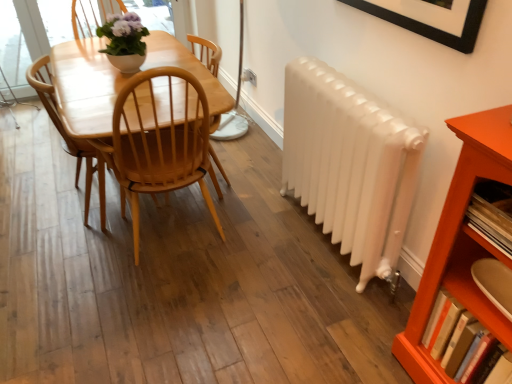
Locate an element on the screen. vacant region in front of white glossy radiator at right is located at coordinates (309, 315).